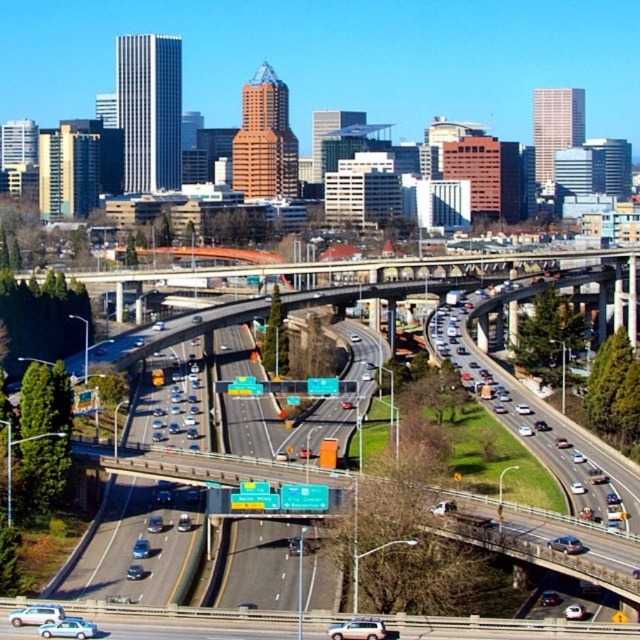
Between metallic silver suv at center and pastel pink matte car at lower left, which one has more height?

Standing taller between the two is pastel pink matte car at lower left.

Does metallic silver suv at center appear on the right side of pastel pink matte car at lower left?

Yes, metallic silver suv at center is to the right of pastel pink matte car at lower left.

Between point (330, 625) and point (38, 604), which one is positioned in front?

Point (38, 604)

I want to click on metallic silver suv at center, so click(356, 628).

Is light blue metallic sedan at lower left closer to camera compared to shiny blue sedan at center?

Yes, light blue metallic sedan at lower left is closer to the viewer.

Does light blue metallic sedan at lower left have a smaller size compared to shiny blue sedan at center?

No, light blue metallic sedan at lower left is not smaller than shiny blue sedan at center.

Is point (76, 620) less distant than point (140, 572)?

Yes, point (76, 620) is in front of point (140, 572).

At what (x,y) coordinates should I click in order to perform the action: click on light blue metallic sedan at lower left. Please return your answer as a coordinate pair (x, y). The height and width of the screenshot is (640, 640). Looking at the image, I should click on (68, 628).

Is white glossy sedan at center to the left of shiny blue sedan at center from the viewer's perspective?

In fact, white glossy sedan at center is to the right of shiny blue sedan at center.

Locate an element on the screen. white glossy sedan at center is located at coordinates (573, 611).

The width and height of the screenshot is (640, 640). I want to click on white glossy sedan at center, so click(x=573, y=611).